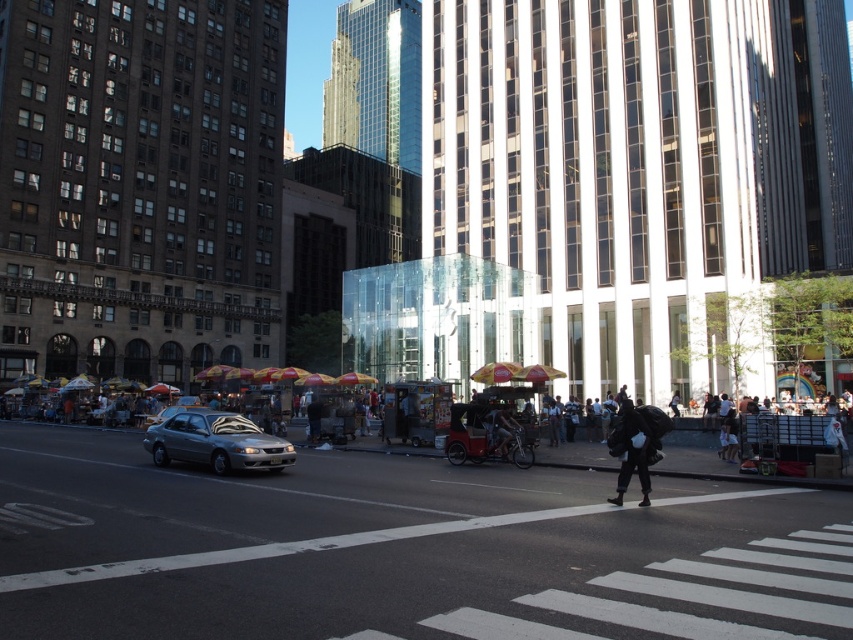
Who is higher up, black matte backpack at lower right or white cotton shirt at center?

Positioned higher is black matte backpack at lower right.

Between point (646, 492) and point (730, 461), which one is positioned in front?

Point (646, 492)

Does point (614, 497) lie in front of point (721, 452)?

Yes, point (614, 497) is closer to viewer.

You are a GUI agent. You are given a task and a screenshot of the screen. Output one action in this format:
    pyautogui.click(x=<x>, y=<y>)
    Task: Click on the black matte backpack at lower right
    The height and width of the screenshot is (640, 853).
    Given the screenshot: What is the action you would take?
    click(631, 451)

Who is taller, satin silver sedan at center or white cotton shirt at center?

Standing taller between the two is white cotton shirt at center.

Which is below, satin silver sedan at center or white cotton shirt at center?

white cotton shirt at center is lower down.

Who is more forward, (x=222, y=412) or (x=724, y=458)?

Point (x=724, y=458)

You are a GUI agent. You are given a task and a screenshot of the screen. Output one action in this format:
    pyautogui.click(x=<x>, y=<y>)
    Task: Click on the satin silver sedan at center
    This screenshot has height=640, width=853.
    Given the screenshot: What is the action you would take?
    pyautogui.click(x=216, y=442)

Between satin silver sedan at center and black matte backpack at lower right, which one appears on the right side from the viewer's perspective?

black matte backpack at lower right is more to the right.

Does satin silver sedan at center have a smaller size compared to black matte backpack at lower right?

Correct, satin silver sedan at center occupies less space than black matte backpack at lower right.

Between point (231, 426) and point (637, 424), which one is positioned behind?

Point (231, 426)

The height and width of the screenshot is (640, 853). I want to click on satin silver sedan at center, so [216, 442].